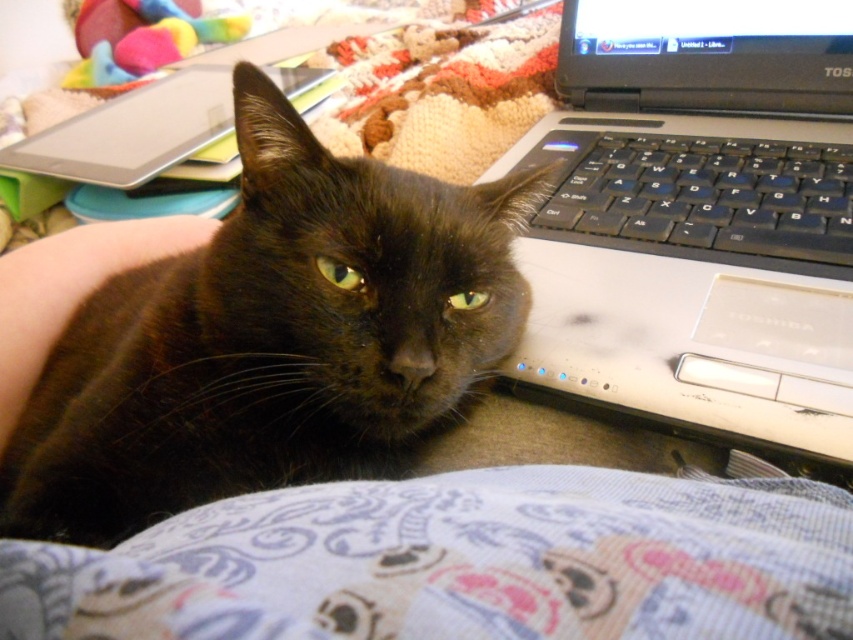
You are a delivery robot with a package that needs to be placed between the silver metallic laptop at center and the soft plush toy at upper left. The package measures 0.9 meters in length. Will it fit in the space between them?

The distance between the silver metallic laptop at center and the soft plush toy at upper left is 1.02 meters. Since the package is 0.9 meters long, it will fit with a small amount of space remaining.

You need to place a rectangular box that is 1.2 meters wide on the desk. The black glossy cat at upper left and the silver metallic laptop at center are already on the desk. Can the box fit between them horizontally?

The black glossy cat at upper left might be wider than the silver metallic laptop at center, so the total width required for both objects is uncertain. Without knowing their exact widths, it is impossible to determine if the 1.2 meter box can fit between them horizontally.